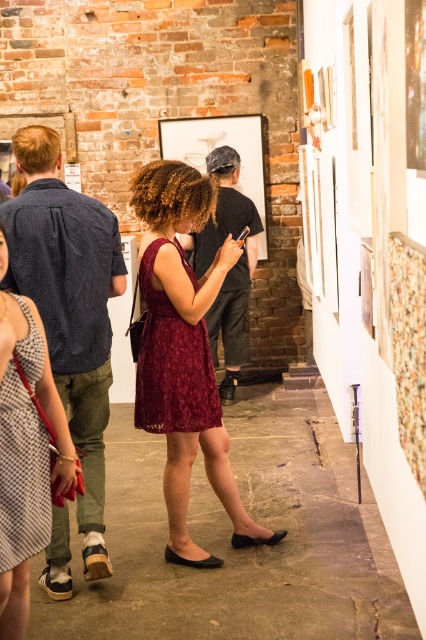
Identify the location of burgundy lace dress at center. (184, 353).

Who is lower down, burgundy lace dress at center or checkered fabric dress at center?

checkered fabric dress at center is lower down.

Find the location of `burgundy lace dress at center`. burgundy lace dress at center is located at coordinates (184, 353).

Identify the location of burgundy lace dress at center. (184, 353).